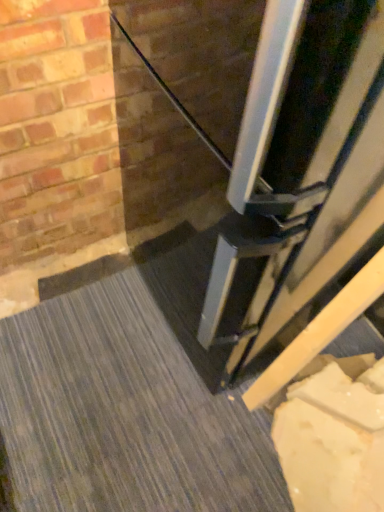
Question: Is white matte concrete at lower right further to the viewer compared to black glossy door at lower center?

Choices:
 (A) yes
 (B) no

Answer: (A)

Question: Is white matte concrete at lower right outside black glossy door at lower center?

Choices:
 (A) yes
 (B) no

Answer: (A)

Question: From a real-world perspective, is white matte concrete at lower right positioned under black glossy door at lower center based on gravity?

Choices:
 (A) yes
 (B) no

Answer: (A)

Question: Is white matte concrete at lower right far away from black glossy door at lower center?

Choices:
 (A) yes
 (B) no

Answer: (B)

Question: Is white matte concrete at lower right facing towards black glossy door at lower center?

Choices:
 (A) yes
 (B) no

Answer: (B)

Question: Does white matte concrete at lower right have a larger size compared to black glossy door at lower center?

Choices:
 (A) yes
 (B) no

Answer: (B)

Question: Considering the relative positions of black glossy door at lower center and white matte concrete at lower right in the image provided, is black glossy door at lower center to the right of white matte concrete at lower right from the viewer's perspective?

Choices:
 (A) yes
 (B) no

Answer: (A)

Question: Is black glossy door at lower center positioned beyond the bounds of white matte concrete at lower right?

Choices:
 (A) no
 (B) yes

Answer: (B)

Question: Does black glossy door at lower center have a greater height compared to white matte concrete at lower right?

Choices:
 (A) yes
 (B) no

Answer: (A)

Question: From the image's perspective, is black glossy door at lower center located above white matte concrete at lower right?

Choices:
 (A) no
 (B) yes

Answer: (B)

Question: Are black glossy door at lower center and white matte concrete at lower right located far from each other?

Choices:
 (A) no
 (B) yes

Answer: (A)

Question: Is the position of black glossy door at lower center less distant than that of white matte concrete at lower right?

Choices:
 (A) yes
 (B) no

Answer: (A)

Question: From the image's perspective, is white matte concrete at lower right above or below black glossy door at lower center?

Choices:
 (A) above
 (B) below

Answer: (B)